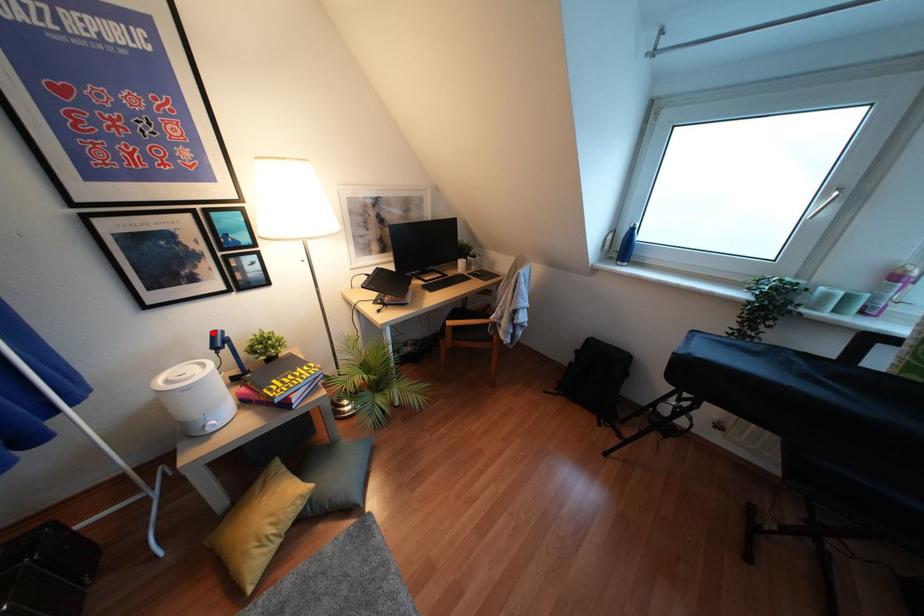
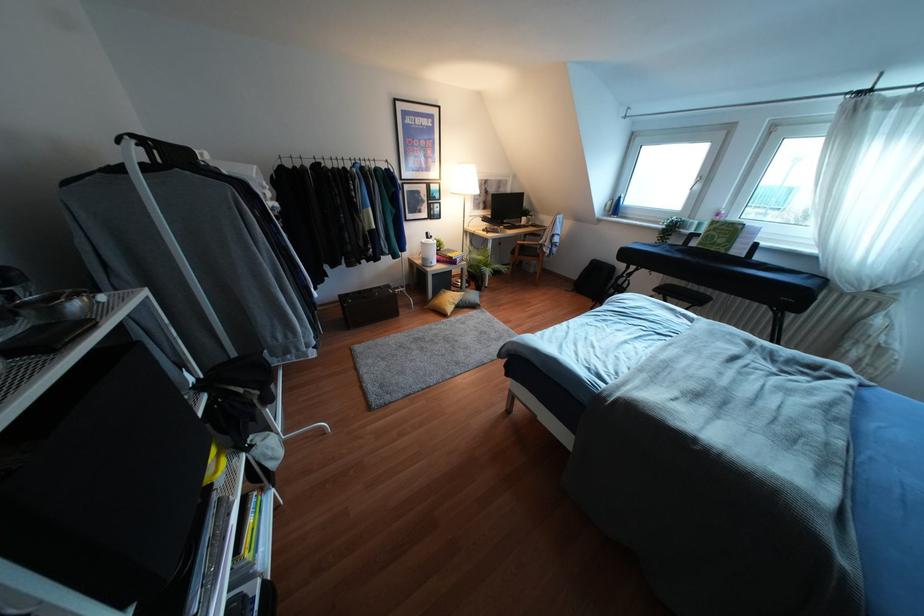
Question: I am providing you with two images of the same scene from different viewpoints. Image1 has a red point marked. In image2, the corresponding 3D location appears at what relative position? Reply with the corresponding letter.

Choices:
 (A) Closer
 (B) Farther

Answer: (A)